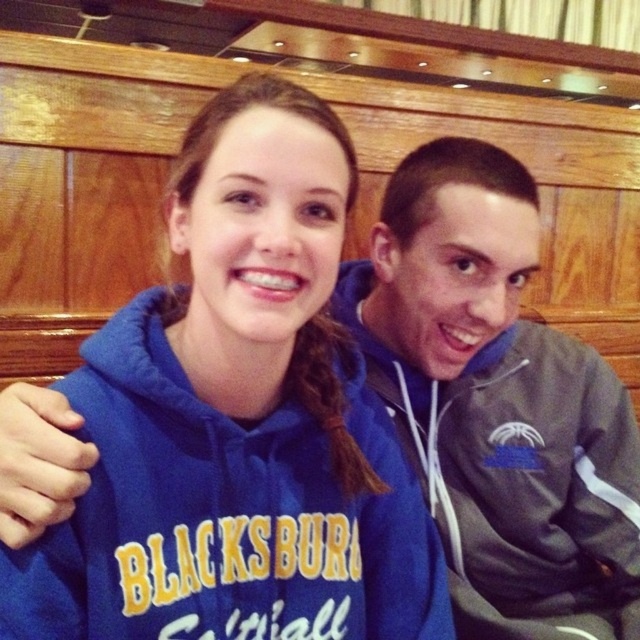
Question: From the image, what is the correct spatial relationship of blue fleece sweatshirt at center in relation to gray fleece jacket at center?

Choices:
 (A) below
 (B) above

Answer: (B)

Question: Among these objects, which one is farthest from the camera?

Choices:
 (A) blue fleece sweatshirt at center
 (B) gray fleece jacket at center

Answer: (B)

Question: Can you confirm if blue fleece sweatshirt at center is smaller than gray fleece jacket at center?

Choices:
 (A) yes
 (B) no

Answer: (A)

Question: Does blue fleece sweatshirt at center have a larger size compared to gray fleece jacket at center?

Choices:
 (A) no
 (B) yes

Answer: (A)